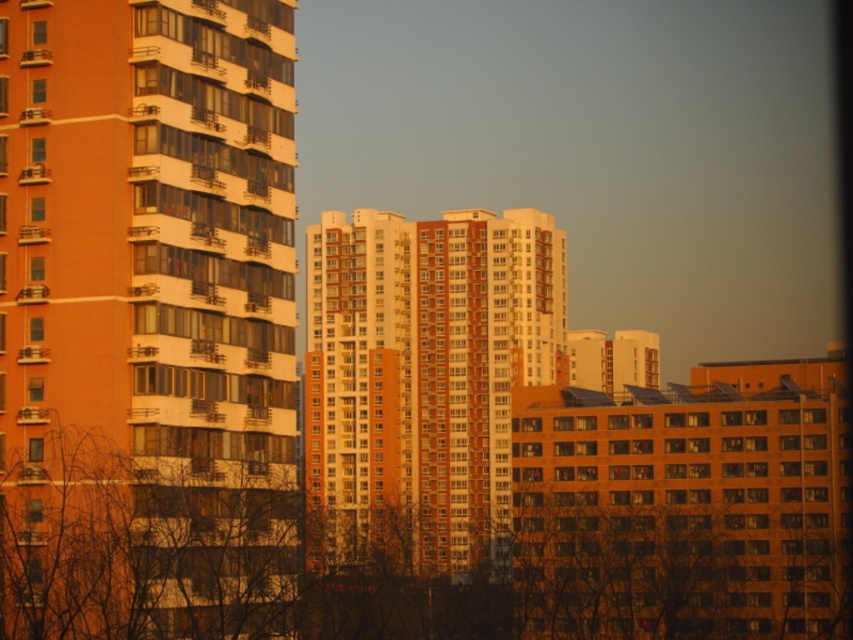
Between matte orange building at left and orange brick building at center, which one has less height?

matte orange building at left is shorter.

Which is in front, point (97, 296) or point (440, 396)?

Positioned in front is point (97, 296).

Is point (282, 484) farther from camera compared to point (436, 362)?

No, it is in front of (436, 362).

I want to click on matte orange building at left, so click(x=146, y=317).

Is matte orange building at left further to the viewer compared to brown leafless branches at lower left?

No, matte orange building at left is closer to the viewer.

Is point (137, 244) in front of point (112, 476)?

That is False.

I want to click on matte orange building at left, so click(146, 317).

The width and height of the screenshot is (853, 640). Describe the element at coordinates (193, 572) in the screenshot. I see `brown leafless branches at lower left` at that location.

Who is more distant from viewer, (51, 584) or (329, 340)?

Positioned behind is point (329, 340).

The height and width of the screenshot is (640, 853). Find the location of `brown leafless branches at lower left`. brown leafless branches at lower left is located at coordinates (193, 572).